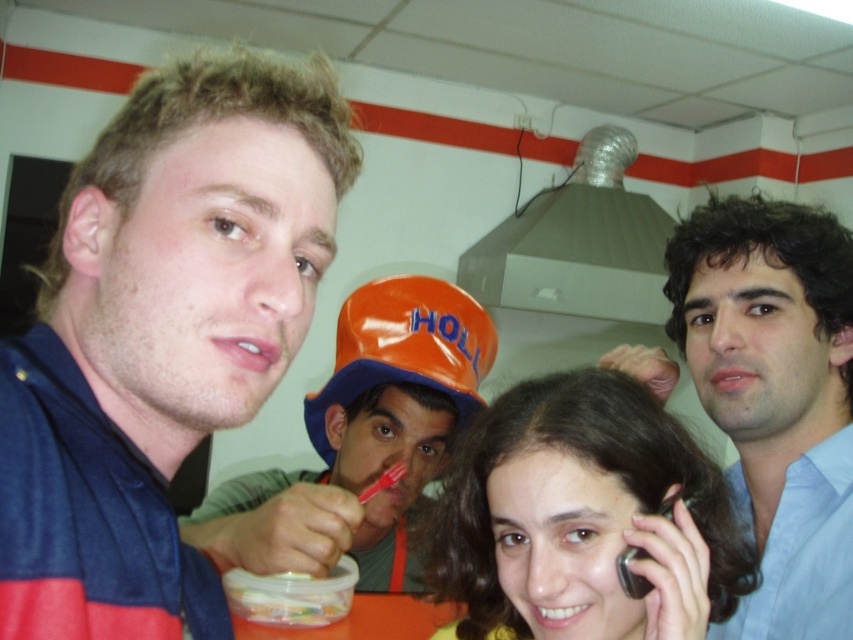
Question: Does blue fabric shirt at center appear over orange plastic baseball hat at center?

Choices:
 (A) no
 (B) yes

Answer: (B)

Question: Where is blue fabric shirt at center located in relation to orange plastic baseball hat at center in the image?

Choices:
 (A) left
 (B) right

Answer: (A)

Question: Can you confirm if matte orange hard hat at center is positioned above orange plastic baseball hat at center?

Choices:
 (A) no
 (B) yes

Answer: (A)

Question: Which point is closer to the camera?

Choices:
 (A) (448, 444)
 (B) (735, 538)

Answer: (B)

Question: Which point is farther to the camera?

Choices:
 (A) matte orange hard hat at center
 (B) blue fabric shirt at center
 (C) matte black phone at center
 (D) blue shirt at right

Answer: (D)

Question: Estimate the real-world distances between objects in this image. Which object is closer to the orange plastic baseball hat at center?

Choices:
 (A) matte black phone at center
 (B) matte orange hard hat at center
 (C) blue shirt at right
 (D) blue fabric shirt at center

Answer: (B)